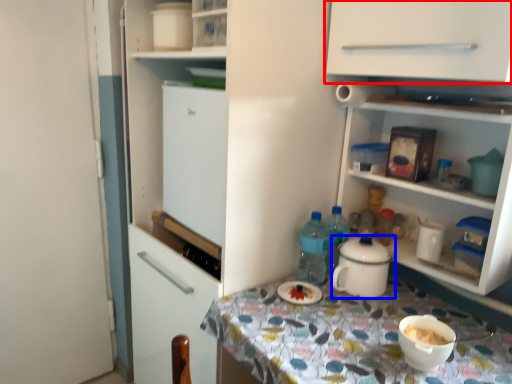
Question: Among these objects, which one is nearest to the camera, cabinetry (highlighted by a red box) or kitchen appliance (highlighted by a blue box)?

Choices:
 (A) cabinetry
 (B) kitchen appliance

Answer: (A)